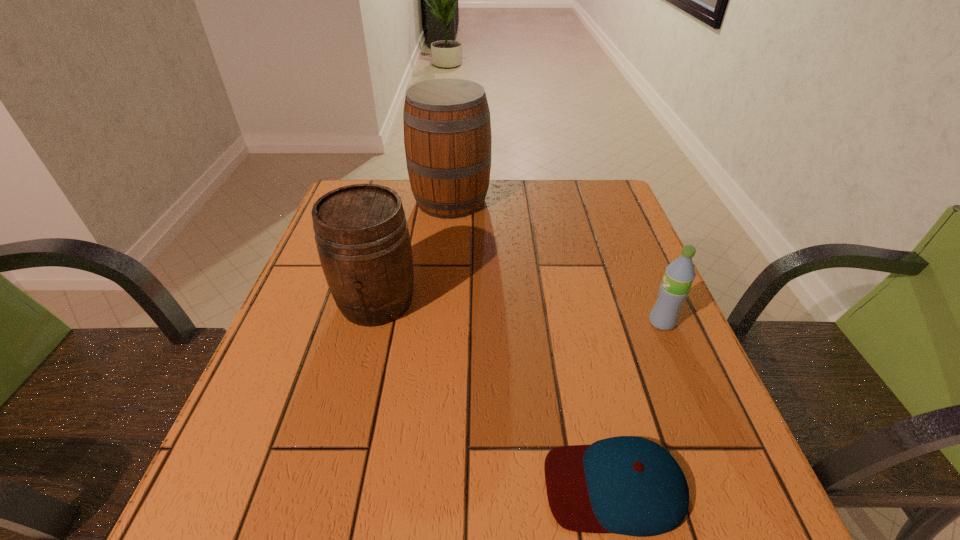
The width and height of the screenshot is (960, 540). I want to click on free space at the far edge, so click(407, 199).

You are a GUI agent. You are given a task and a screenshot of the screen. Output one action in this format:
    pyautogui.click(x=<x>, y=<y>)
    Task: Click on the free space at the near edge of the desktop
    The image size is (960, 540).
    Given the screenshot: What is the action you would take?
    pyautogui.click(x=444, y=508)

Locate an element on the screen. vacant position at the left edge of the desktop is located at coordinates (305, 273).

In the image, there is a desktop. Where is `vacant space at the right edge`? The image size is (960, 540). vacant space at the right edge is located at coordinates (640, 429).

Find the location of a particular element. free space at the far right corner of the desktop is located at coordinates (588, 187).

The width and height of the screenshot is (960, 540). Find the location of `unoccupied area between the water bottle and the nearer cider`. unoccupied area between the water bottle and the nearer cider is located at coordinates (519, 312).

Identify the location of vacant region between the third tallest object and the second object from right to left. click(x=638, y=404).

Find the location of `vacant space that is in between the shorter cider and the third tallest object`. vacant space that is in between the shorter cider and the third tallest object is located at coordinates (519, 312).

You are a GUI agent. You are given a task and a screenshot of the screen. Output one action in this format:
    pyautogui.click(x=<x>, y=<y>)
    Task: Click on the free space between the third shortest object and the second shortest object
    The image size is (960, 540).
    Given the screenshot: What is the action you would take?
    pyautogui.click(x=519, y=312)

Locate an element on the screen. Image resolution: width=960 pixels, height=540 pixels. vacant space in between the second tallest object and the shortest object is located at coordinates (495, 394).